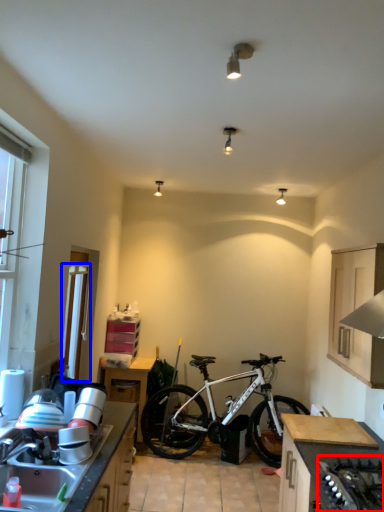
Question: Which of the following is the closest to the observer, gas stove (highlighted by a red box) or screen door (highlighted by a blue box)?

Choices:
 (A) gas stove
 (B) screen door

Answer: (A)